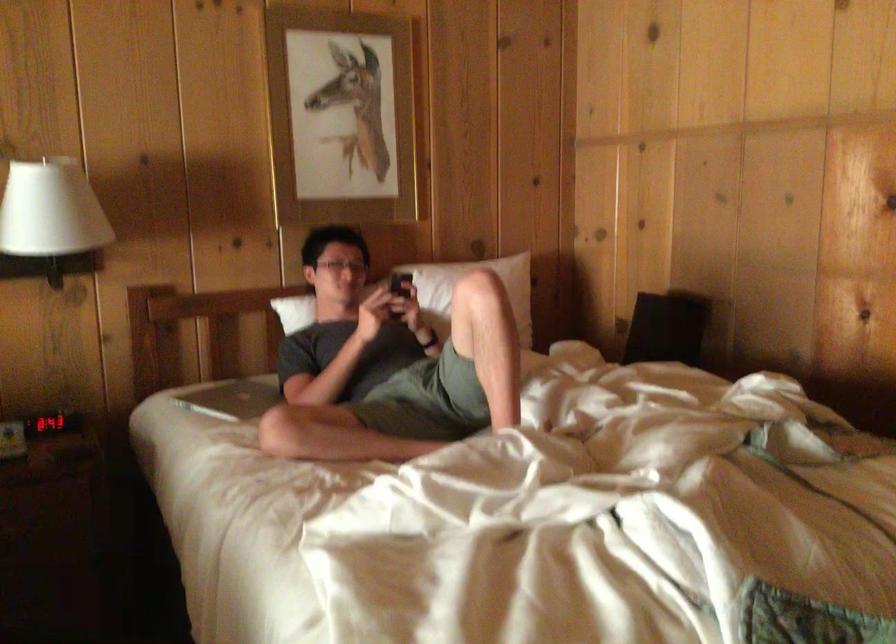
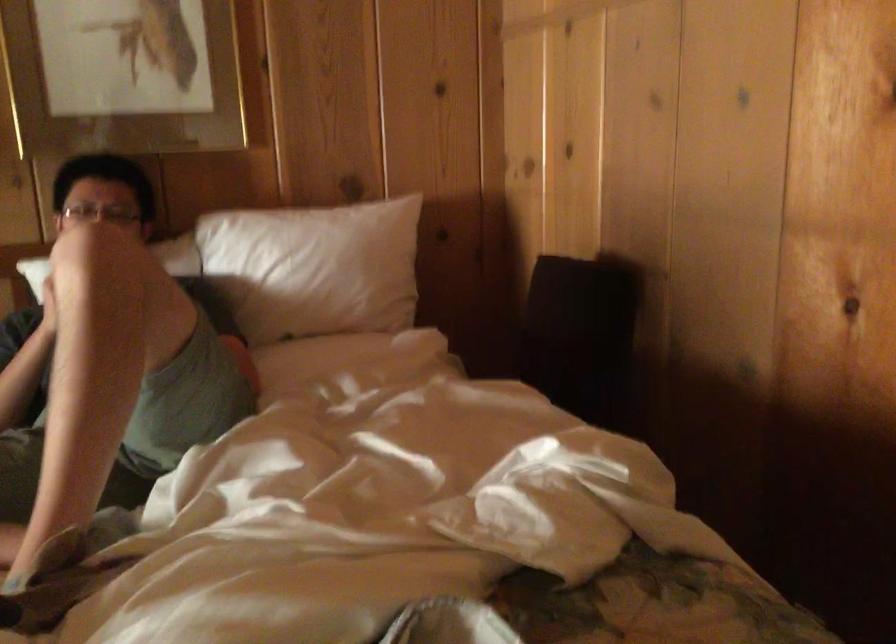
Which direction would the cameraman need to move to produce the second image?

The movement direction of the cameraman is right, forward.